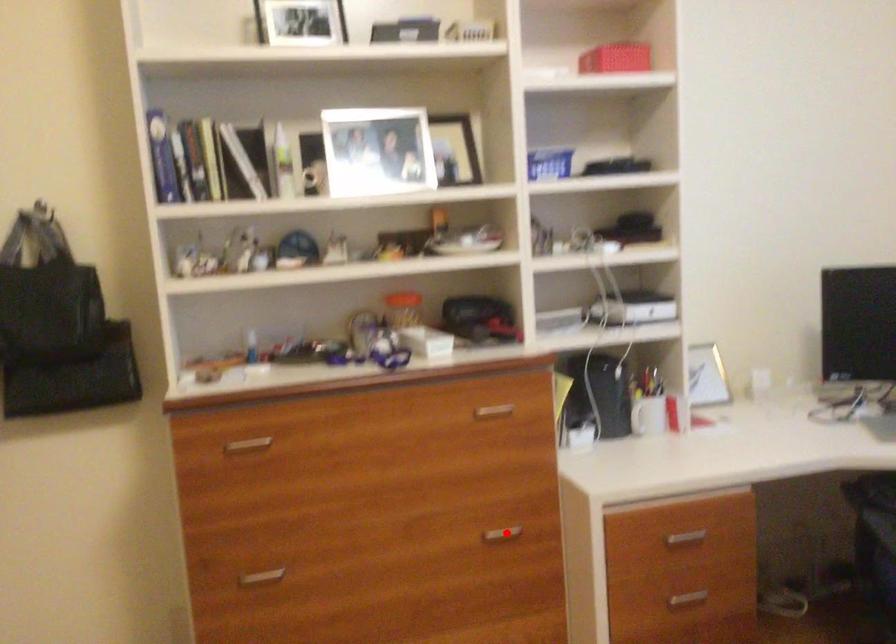
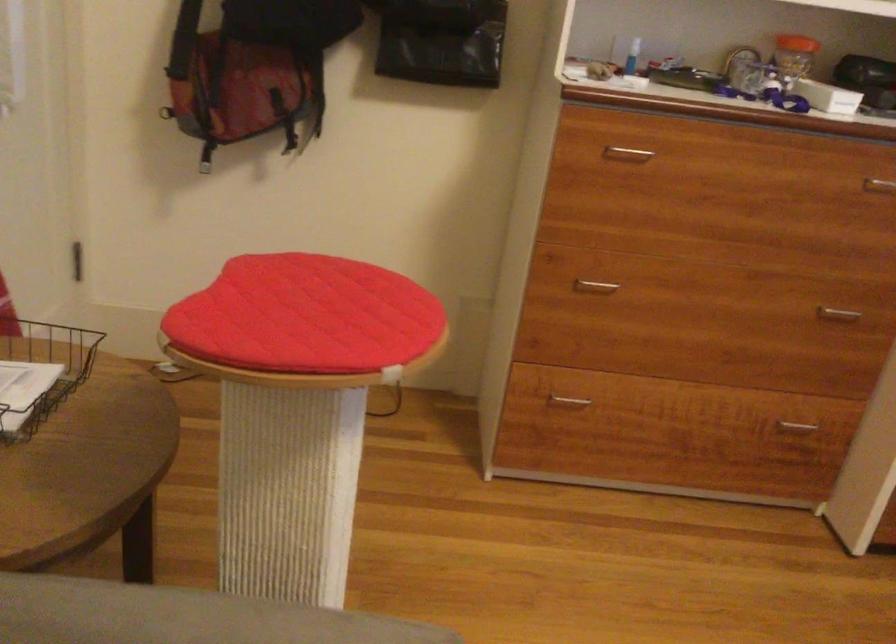
Where in the second image is the point corresponding to the highlighted location from the first image?

(837, 313)